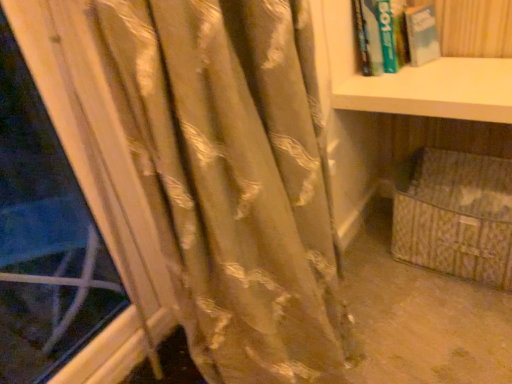
Find the location of a particular element. satin gold curtain at left is located at coordinates (226, 178).

Is beige woven basket at lower right outside of satin gold curtain at left?

Yes, beige woven basket at lower right is located beyond the bounds of satin gold curtain at left.

Consider the image. Are beige woven basket at lower right and satin gold curtain at left located far from each other?

beige woven basket at lower right is actually quite close to satin gold curtain at left.

Which object is further away from the camera, beige woven basket at lower right or satin gold curtain at left?

beige woven basket at lower right is further away from the camera.

In the scene shown: Does beige woven basket at lower right have a larger size compared to satin gold curtain at left?

Actually, beige woven basket at lower right might be smaller than satin gold curtain at left.

Considering the positions of objects beige woven basket at lower right and beige fabric basket at lower right in the image provided, who is more to the right, beige woven basket at lower right or beige fabric basket at lower right?

beige woven basket at lower right.

Does beige woven basket at lower right have a smaller size compared to beige fabric basket at lower right?

Yes.

Is beige woven basket at lower right oriented towards beige fabric basket at lower right?

Yes, beige woven basket at lower right is turned towards beige fabric basket at lower right.

In terms of width, does beige woven basket at lower right look wider or thinner when compared to beige fabric basket at lower right?

In the image, beige woven basket at lower right appears to be wider than beige fabric basket at lower right.

In terms of width, does satin gold curtain at left look wider or thinner when compared to beige woven basket at lower right?

Considering their sizes, satin gold curtain at left looks slimmer than beige woven basket at lower right.

From a real-world perspective, is satin gold curtain at left located beneath beige woven basket at lower right?

No, from a real-world perspective, satin gold curtain at left is not under beige woven basket at lower right.

How different are the orientations of satin gold curtain at left and beige woven basket at lower right in degrees?

The angular difference between satin gold curtain at left and beige woven basket at lower right is 90 degrees.

Considering the sizes of satin gold curtain at left and beige woven basket at lower right in the image, is satin gold curtain at left bigger or smaller than beige woven basket at lower right?

Clearly, satin gold curtain at left is larger in size than beige woven basket at lower right.

Is beige fabric basket at lower right further to the viewer compared to satin gold curtain at left?

That is True.

Is beige fabric basket at lower right far away from satin gold curtain at left?

No, beige fabric basket at lower right is not far away from satin gold curtain at left.

Looking at this image, from the image's perspective, would you say beige fabric basket at lower right is positioned over satin gold curtain at left?

Yes, from the image's perspective, beige fabric basket at lower right is over satin gold curtain at left.

Considering the relative sizes of green matte book at upper right and satin gold curtain at left in the image provided, is green matte book at upper right wider than satin gold curtain at left?

Incorrect, the width of green matte book at upper right does not surpass that of satin gold curtain at left.

Is green matte book at upper right not inside satin gold curtain at left?

Yes, green matte book at upper right is not within satin gold curtain at left.

Is green matte book at upper right looking in the opposite direction of satin gold curtain at left?

No.

Who is taller, green matte book at upper right or satin gold curtain at left?

With more height is satin gold curtain at left.

Are beige woven basket at lower right and green matte book at upper right beside each other?

beige woven basket at lower right and green matte book at upper right are clearly separated.

Considering the sizes of beige woven basket at lower right and green matte book at upper right in the image, is beige woven basket at lower right taller or shorter than green matte book at upper right?

In the image, beige woven basket at lower right appears to be taller than green matte book at upper right.

Is beige woven basket at lower right behind green matte book at upper right?

No, beige woven basket at lower right is in front of green matte book at upper right.

Could you tell me if beige woven basket at lower right is turned towards green matte book at upper right?

No.

In terms of size, does satin gold curtain at left appear bigger or smaller than beige fabric basket at lower right?

satin gold curtain at left is smaller than beige fabric basket at lower right.

Does satin gold curtain at left turn towards beige fabric basket at lower right?

No, satin gold curtain at left is not oriented towards beige fabric basket at lower right.

Locate an element on the screen. This screenshot has width=512, height=384. curtain on the left of beige fabric basket at lower right is located at coordinates (226, 178).

Is beige fabric basket at lower right a part of satin gold curtain at left?

No, beige fabric basket at lower right is not a part of satin gold curtain at left.

This screenshot has width=512, height=384. What are the coordinates of `basket on the right of satin gold curtain at left` in the screenshot? It's located at (455, 215).

The height and width of the screenshot is (384, 512). Identify the location of basket located underneath the beige fabric basket at lower right (from a real-world perspective). 455,215.

From the image, which object appears to be nearer to green matte book at upper right, satin gold curtain at left or beige fabric basket at lower right?

The object closer to green matte book at upper right is beige fabric basket at lower right.

Considering their positions, is beige woven basket at lower right positioned closer to green matte book at upper right than beige fabric basket at lower right?

The object closer to green matte book at upper right is beige fabric basket at lower right.

Estimate the real-world distances between objects in this image. Which object is closer to green matte book at upper right, beige woven basket at lower right or satin gold curtain at left?

The object closer to green matte book at upper right is beige woven basket at lower right.

Based on their spatial positions, is beige fabric basket at lower right or beige woven basket at lower right further from green matte book at upper right?

Based on the image, beige woven basket at lower right appears to be further to green matte book at upper right.

Which object lies further to the anchor point beige woven basket at lower right, beige fabric basket at lower right or green matte book at upper right?

green matte book at upper right.

When comparing their distances from beige fabric basket at lower right, does beige woven basket at lower right or satin gold curtain at left seem further?

The object further to beige fabric basket at lower right is satin gold curtain at left.

Based on their spatial positions, is green matte book at upper right or beige fabric basket at lower right further from beige woven basket at lower right?

green matte book at upper right.

Consider the image. Considering their positions, is beige fabric basket at lower right positioned further to satin gold curtain at left than beige woven basket at lower right?

beige woven basket at lower right is positioned further to the anchor satin gold curtain at left.

In order to click on basket between satin gold curtain at left and green matte book at upper right along the z-axis in this screenshot , I will do `click(455, 215)`.

Identify the location of bookcase between satin gold curtain at left and green matte book at upper right from front to back. (436, 151).

Identify the location of bookcase between green matte book at upper right and beige woven basket at lower right in the up-down direction. (436, 151).

Find the location of a particular element. The image size is (512, 384). bookcase located between satin gold curtain at left and beige woven basket at lower right in the depth direction is located at coordinates (436, 151).